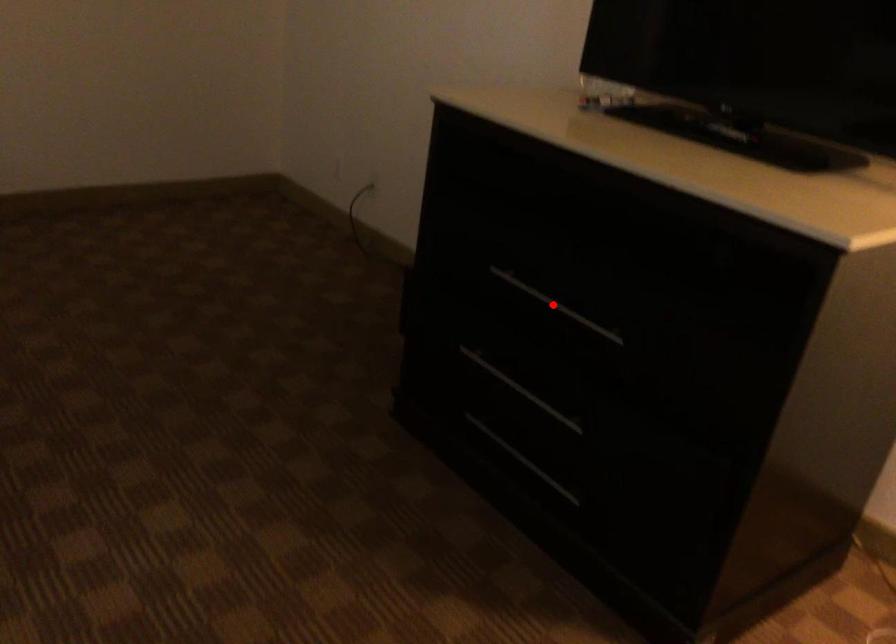
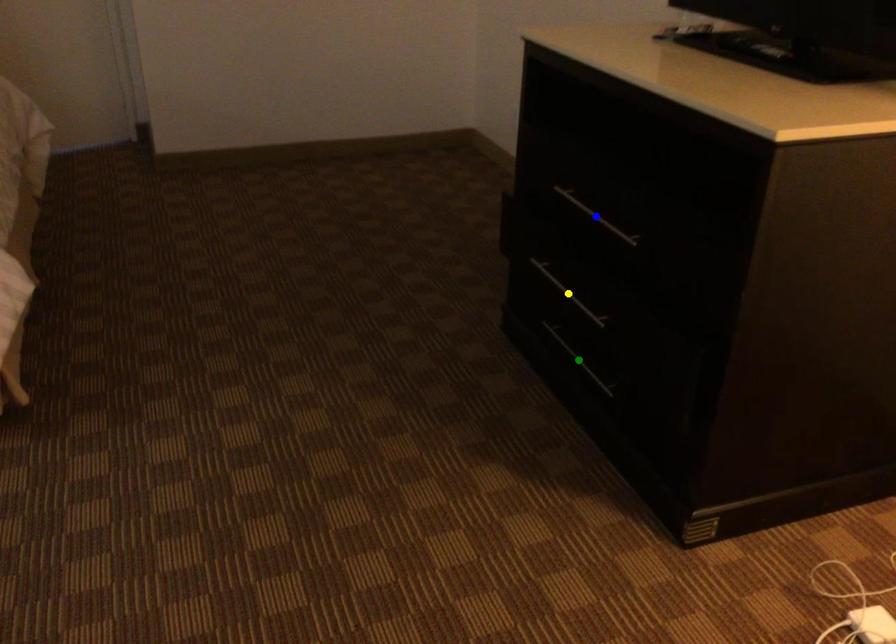
Question: I am providing you with two images of the same scene from different viewpoints. A red point is marked on the first image. You are given multiple points on the second image. Which mark in image 2 goes with the point in image 1?

Choices:
 (A) yellow point
 (B) green point
 (C) blue point

Answer: (C)